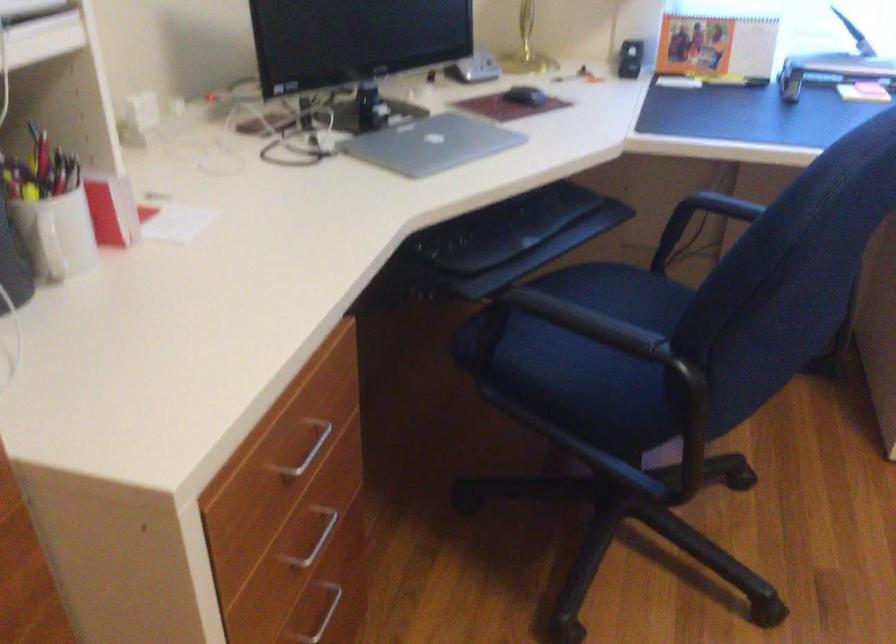
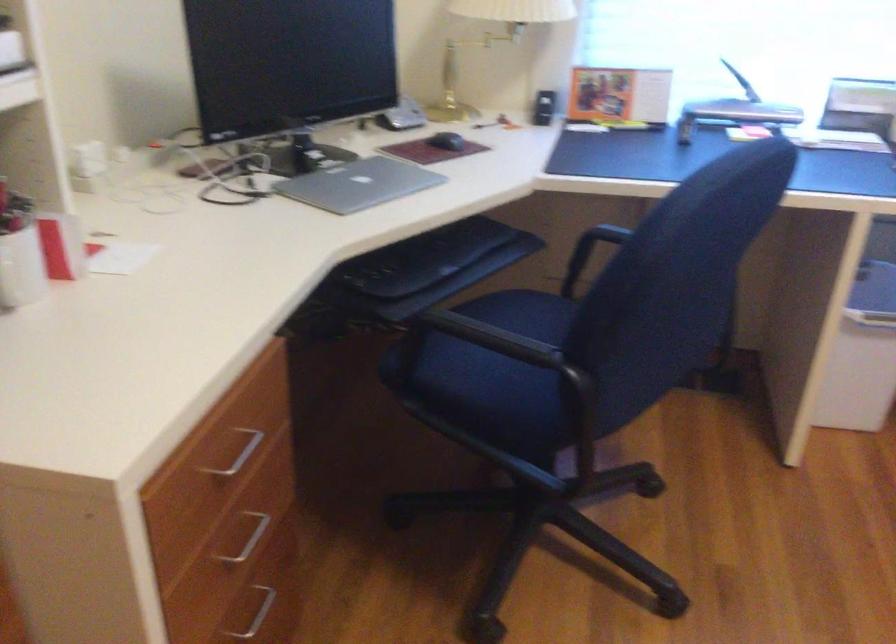
Where in the second image is the point corresponding to point 302,446 from the first image?

(238, 453)